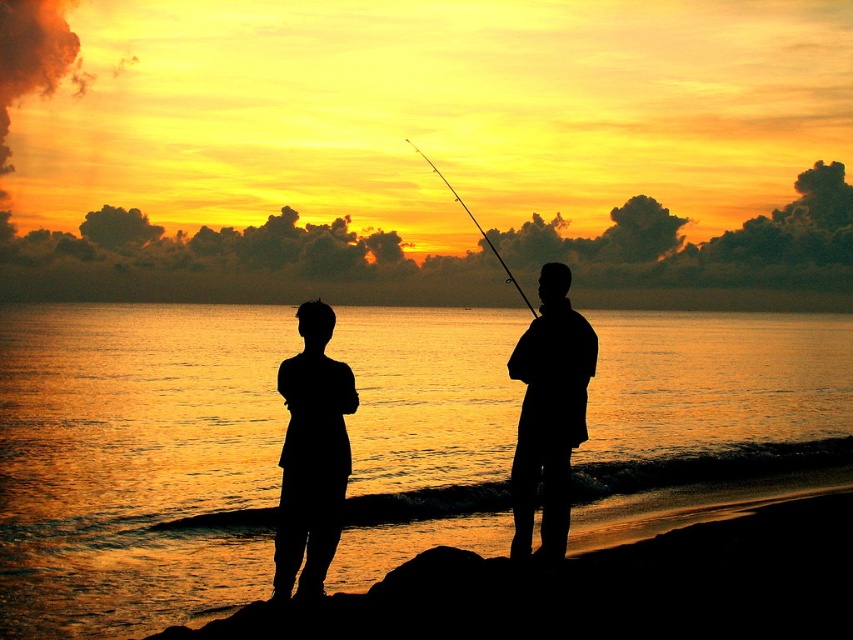
The width and height of the screenshot is (853, 640). What are the coordinates of `golden reflective water at center` in the screenshot? It's located at (134, 461).

Who is lower down, golden reflective water at center or smooth rod at center?

golden reflective water at center is below.

What do you see at coordinates (134, 461) in the screenshot? The image size is (853, 640). I see `golden reflective water at center` at bounding box center [134, 461].

Locate an element on the screen. This screenshot has height=640, width=853. golden reflective water at center is located at coordinates (134, 461).

Can you confirm if silhouette fishing rod at center is positioned to the left of smooth rod at center?

Incorrect, silhouette fishing rod at center is not on the left side of smooth rod at center.

This screenshot has height=640, width=853. I want to click on silhouette fishing rod at center, so click(549, 412).

Does point (442, 310) come farther from viewer compared to point (521, 356)?

Yes, it is behind point (521, 356).

Does golden reflective water at center have a smaller size compared to silhouette fishing rod at center?

Actually, golden reflective water at center might be larger than silhouette fishing rod at center.

What are the coordinates of `golden reflective water at center` in the screenshot? It's located at (134, 461).